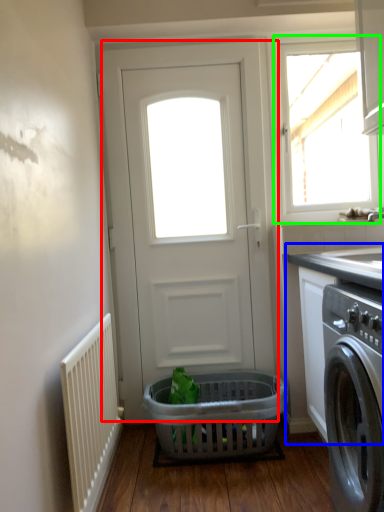
Question: Based on their relative distances, which object is nearer to door (highlighted by a red box)? Choose from counter top (highlighted by a blue box) and window (highlighted by a green box).

Choices:
 (A) counter top
 (B) window

Answer: (A)